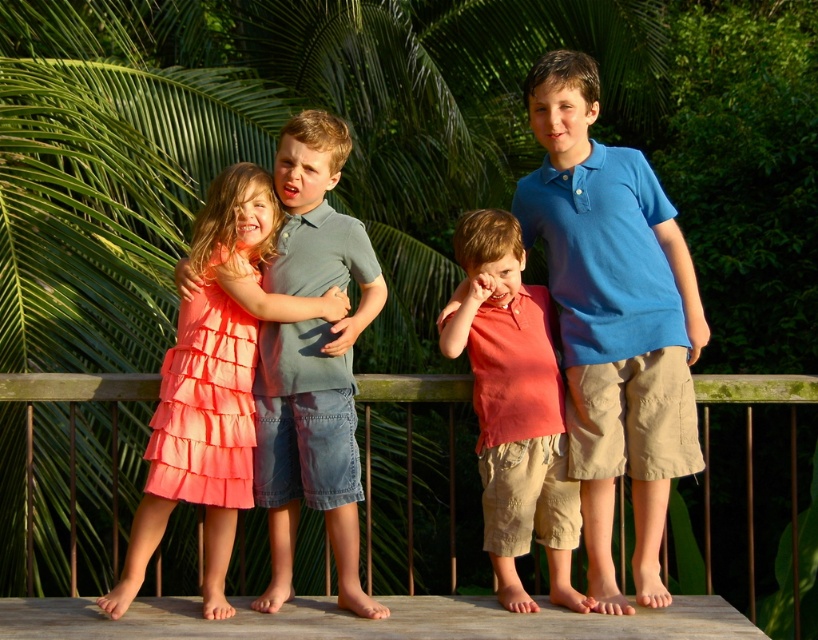
You are a photographer setting up a shot of the blue cotton shirt at center and the wooden at center. You want to ensure both subjects are in focus. Which subject should you focus on first to account for their height difference?

The blue cotton shirt at center is much taller than the wooden at center, so you should focus on the blue cotton shirt at center first to ensure both are in focus.

You are a photographer trying to capture a photo of the blue cotton shirt at center and the wooden at center. Which object should you focus on first to ensure both are in focus?

The wooden at center is further away than the blue cotton shirt at center, so you should focus on the wooden at center first to ensure both are in focus.

You are a photographer trying to capture a photo of the blue cotton shirt at center and the wooden at center. Which object is positioned higher in the frame?

The blue cotton shirt at center is above wooden at center, so it is positioned higher in the frame.